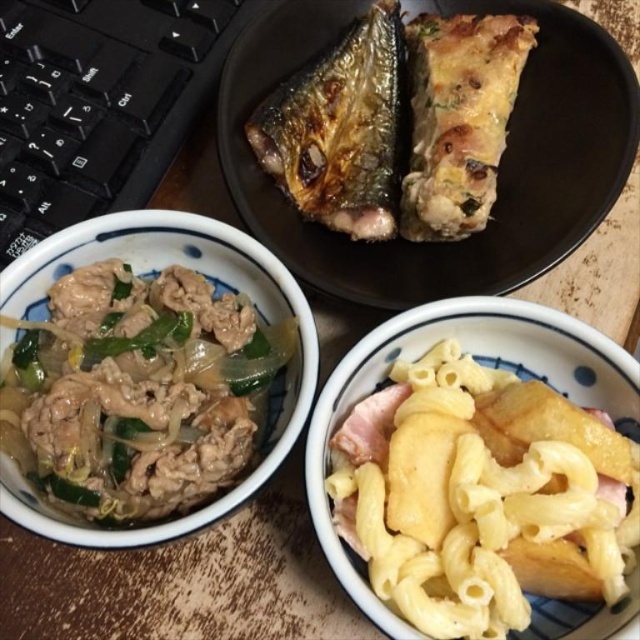
Between yellow matte pasta at lower right and black matte plate at upper center, which one is positioned lower?

yellow matte pasta at lower right is lower down.

You are a GUI agent. You are given a task and a screenshot of the screen. Output one action in this format:
    pyautogui.click(x=<x>, y=<y>)
    Task: Click on the yellow matte pasta at lower right
    
    Given the screenshot: What is the action you would take?
    pyautogui.click(x=481, y=496)

Find the location of a particular element. yellow matte pasta at lower right is located at coordinates (481, 496).

Can you confirm if yellow matte pasta at lower right is smaller than grilled fish at upper center?

No, yellow matte pasta at lower right is not smaller than grilled fish at upper center.

Which of these two, yellow matte pasta at lower right or grilled fish at upper center, stands shorter?

yellow matte pasta at lower right

Describe the element at coordinates (481, 496) in the screenshot. I see `yellow matte pasta at lower right` at that location.

You are a GUI agent. You are given a task and a screenshot of the screen. Output one action in this format:
    pyautogui.click(x=<x>, y=<y>)
    Task: Click on the yellow matte pasta at lower right
    The width and height of the screenshot is (640, 640).
    Given the screenshot: What is the action you would take?
    pyautogui.click(x=481, y=496)

Can you confirm if slightly translucent glass bowl at center is smaller than grilled fish at upper center?

No, slightly translucent glass bowl at center is not smaller than grilled fish at upper center.

Where is `slightly translucent glass bowl at center`? Image resolution: width=640 pixels, height=640 pixels. slightly translucent glass bowl at center is located at coordinates (141, 275).